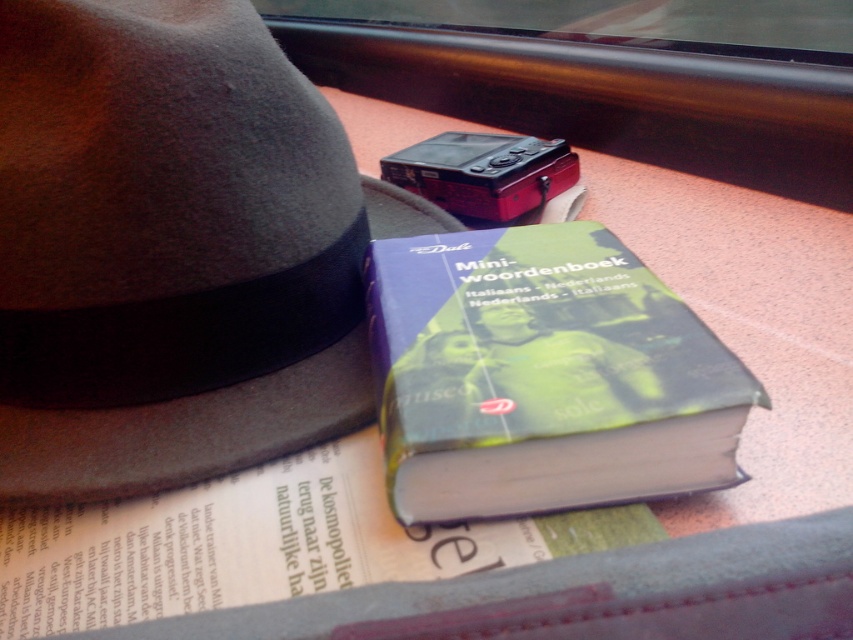
Based on the coordinates provided, which object is located at point (173, 250)?

The gray felt fedora at upper left is located at point (173, 250).

You are a passenger on a train and need to place your gray felt fedora at upper left on the seat next to you. The seat has a coordinate system where the bottom left corner is the origin. Can you confirm if placing it at coordinate point 0.391, 0.204 would be within the seat area?

The gray felt fedora at upper left is positioned at point [173,250], so placing it there would be within the seat area.

You are a traveler who wants to place a small notebook between the gray felt fedora at upper left and the hardcover book at center. The notebook is 3 inches thick. Can you fit it between them?

The gray felt fedora at upper left is 5.11 inches away from the hardcover book at center. Since the notebook is only 3 inches thick, there is enough space to fit it between them.